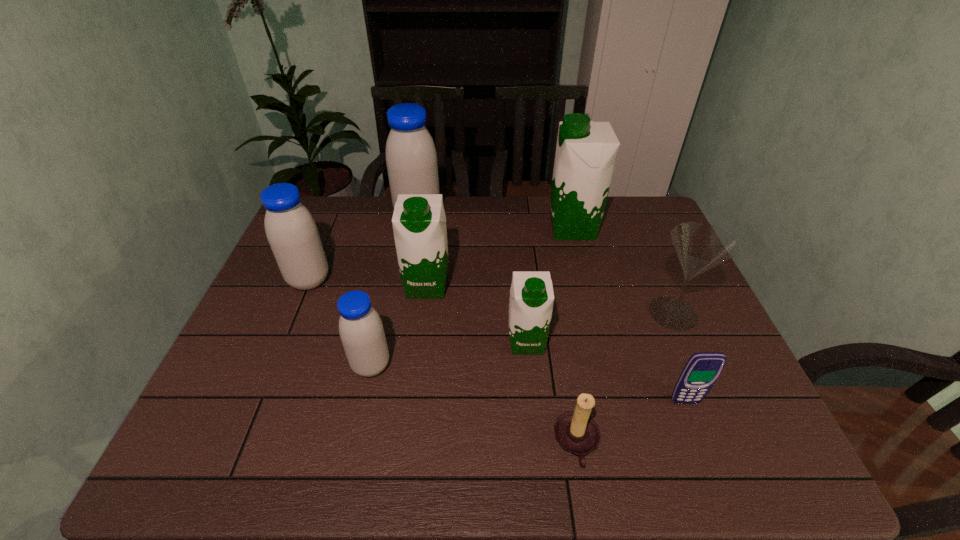
Where is `the smallest blue soya milk`? the smallest blue soya milk is located at coordinates (361, 330).

I want to click on cellular telephone, so click(701, 371).

This screenshot has width=960, height=540. I want to click on the nearest object, so click(x=578, y=434).

You are a GUI agent. You are given a task and a screenshot of the screen. Output one action in this format:
    pyautogui.click(x=<x>, y=<y>)
    Task: Click on the brown candle holder
    This screenshot has height=540, width=960.
    Given the screenshot: What is the action you would take?
    point(578,434)

At what (x,y) coordinates should I click in order to perform the action: click on free region located on the front-facing side of the biggest green soya milk. Please return your answer as a coordinate pair (x, y). Image resolution: width=960 pixels, height=540 pixels. Looking at the image, I should click on (511, 228).

Find the location of a particular element. The image size is (960, 540). vacant space located on the front-facing side of the biggest green soya milk is located at coordinates (516, 228).

The width and height of the screenshot is (960, 540). Find the location of `free space located on the front-facing side of the biggest green soya milk`. free space located on the front-facing side of the biggest green soya milk is located at coordinates (429, 228).

I want to click on free space located 0.190m on the front of the biggest blue soya milk, so click(409, 270).

Image resolution: width=960 pixels, height=540 pixels. I want to click on vacant position located 0.300m on the back of the second smallest blue soya milk, so click(x=339, y=209).

I want to click on vacant region located 0.230m on the front-facing side of the second nearest green soya milk, so click(416, 373).